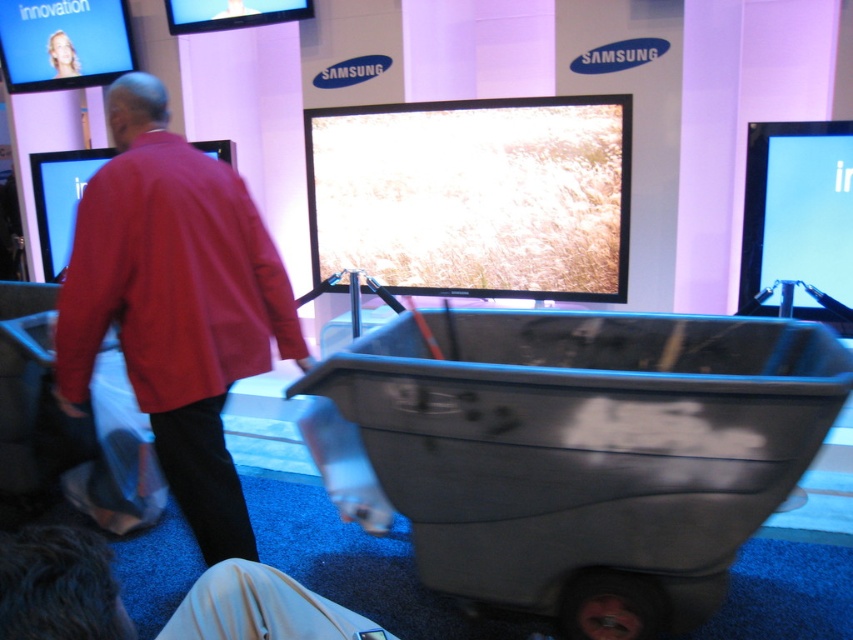
In the scene shown: You are an event organizer at the Samsung exhibition. You need to place a promotional banner between the gray plastic cart at center and the red cotton shirt at center. Which object should the banner be placed closer to if you want it to be more visible to attendees entering the exhibition?

The gray plastic cart at center is larger in size than the red cotton shirt at center, so placing the banner closer to the gray plastic cart at center would make it more visible to attendees entering the exhibition.

In the scene shown: You are at a Samsung exhibition and notice a gray plastic cart at center and a red cotton shirt at center. From your perspective, which object is positioned to the right side?

The gray plastic cart at center is positioned to the right of the red cotton shirt at center.

You are at a Samsung exhibition and notice a gray plastic cart at center and a red cotton shirt at center. Which object is closer to the floor?

The gray plastic cart at center is closer to the floor because it is positioned below the red cotton shirt at center.